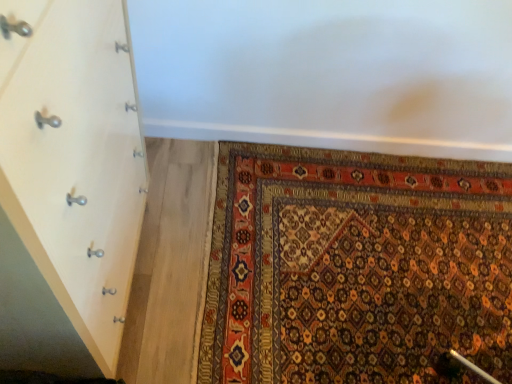
Question: Should I look upward or downward to see carpet with intricate patterns at lower right?

Choices:
 (A) down
 (B) up

Answer: (A)

Question: Does carpet with intricate patterns at lower right have a greater height compared to white wood chest of drawers at left?

Choices:
 (A) no
 (B) yes

Answer: (A)

Question: From the image's perspective, is carpet with intricate patterns at lower right over white wood chest of drawers at left?

Choices:
 (A) yes
 (B) no

Answer: (B)

Question: Is carpet with intricate patterns at lower right outside of white wood chest of drawers at left?

Choices:
 (A) no
 (B) yes

Answer: (B)

Question: Does carpet with intricate patterns at lower right have a smaller size compared to white wood chest of drawers at left?

Choices:
 (A) no
 (B) yes

Answer: (B)

Question: Is white wood chest of drawers at left at the back of carpet with intricate patterns at lower right?

Choices:
 (A) no
 (B) yes

Answer: (A)

Question: Is white wood chest of drawers at left a part of carpet with intricate patterns at lower right?

Choices:
 (A) yes
 (B) no

Answer: (B)

Question: Is white wood chest of drawers at left to the left of carpet with intricate patterns at lower right from the viewer's perspective?

Choices:
 (A) yes
 (B) no

Answer: (A)

Question: Is white wood chest of drawers at left located outside carpet with intricate patterns at lower right?

Choices:
 (A) no
 (B) yes

Answer: (B)

Question: Can you confirm if white wood chest of drawers at left is thinner than carpet with intricate patterns at lower right?

Choices:
 (A) yes
 (B) no

Answer: (A)

Question: Is white wood chest of drawers at left closer to the viewer compared to carpet with intricate patterns at lower right?

Choices:
 (A) yes
 (B) no

Answer: (A)

Question: Considering the relative sizes of white wood chest of drawers at left and carpet with intricate patterns at lower right in the image provided, is white wood chest of drawers at left taller than carpet with intricate patterns at lower right?

Choices:
 (A) yes
 (B) no

Answer: (A)

Question: Does white wood chest of drawers at left have a lesser height compared to carpet with intricate patterns at lower right?

Choices:
 (A) yes
 (B) no

Answer: (B)

Question: Would you say carpet with intricate patterns at lower right is inside or outside white wood chest of drawers at left?

Choices:
 (A) outside
 (B) inside

Answer: (A)